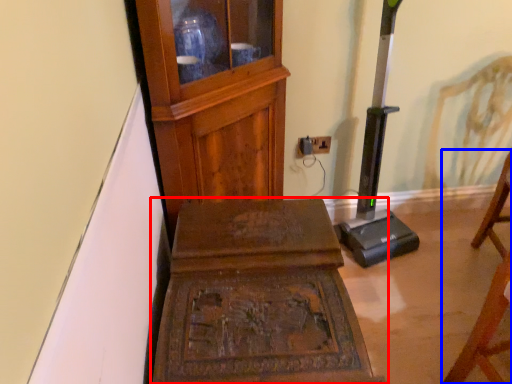
Question: Which point is further to the camera, furniture (highlighted by a red box) or furniture (highlighted by a blue box)?

Choices:
 (A) furniture
 (B) furniture

Answer: (A)